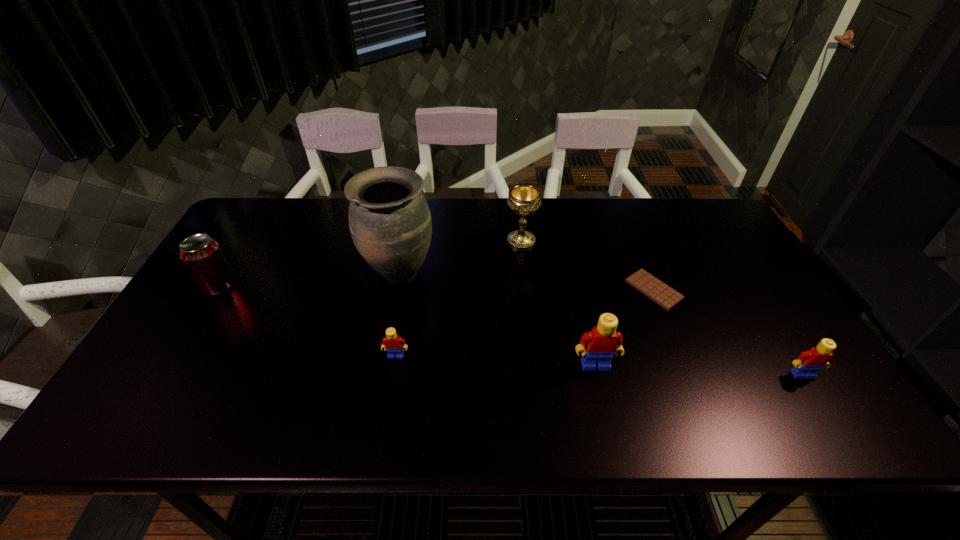
Given the evenly spaced Legos in the image, where should an extra Lego be added on the left to preserve the spacing? Please point to a vacant space. Please provide its 2D coordinates. Your answer should be formatted as a tuple, i.e. [(x, y)], where the tuple contains the x and y coordinates of a point satisfying the conditions above.

[(204, 347)]